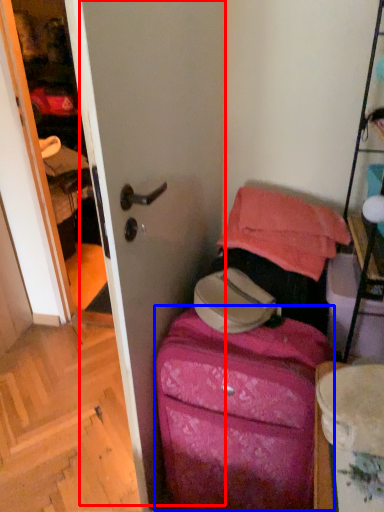
Question: Which object is further to the camera taking this photo, screen door (highlighted by a red box) or luggage (highlighted by a blue box)?

Choices:
 (A) screen door
 (B) luggage

Answer: (B)